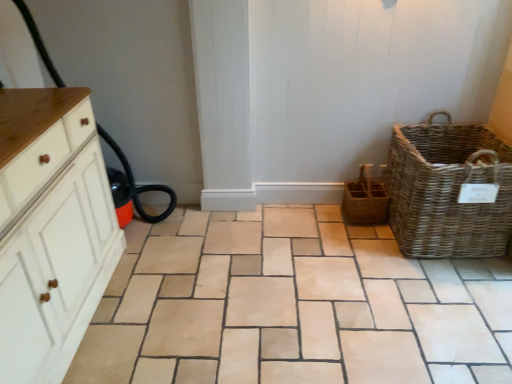
Question: Is white wood cabinet at left wider than natural stone tile at center?

Choices:
 (A) no
 (B) yes

Answer: (A)

Question: From a real-world perspective, is white wood cabinet at left under natural stone tile at center?

Choices:
 (A) no
 (B) yes

Answer: (A)

Question: Considering the relative sizes of white wood cabinet at left and natural stone tile at center in the image provided, is white wood cabinet at left bigger than natural stone tile at center?

Choices:
 (A) yes
 (B) no

Answer: (A)

Question: Is white wood cabinet at left completely or partially outside of natural stone tile at center?

Choices:
 (A) no
 (B) yes

Answer: (B)

Question: Can you confirm if white wood cabinet at left is shorter than natural stone tile at center?

Choices:
 (A) yes
 (B) no

Answer: (B)

Question: Is white wood cabinet at left bigger or smaller than brown woven basket at center-right?

Choices:
 (A) big
 (B) small

Answer: (A)

Question: From the image's perspective, is white wood cabinet at left positioned above or below brown woven basket at center-right?

Choices:
 (A) below
 (B) above

Answer: (A)

Question: Considering the positions of point (32, 94) and point (358, 205), is point (32, 94) closer or farther from the camera than point (358, 205)?

Choices:
 (A) farther
 (B) closer

Answer: (B)

Question: Relative to brown woven basket at center-right, is white wood cabinet at left in front or behind?

Choices:
 (A) behind
 (B) front

Answer: (B)

Question: Based on their positions, is natural woven picnic basket at right located to the left or right of brown woven basket at center-right?

Choices:
 (A) left
 (B) right

Answer: (B)

Question: From their relative heights in the image, would you say natural woven picnic basket at right is taller or shorter than brown woven basket at center-right?

Choices:
 (A) short
 (B) tall

Answer: (B)

Question: In terms of size, does natural woven picnic basket at right appear bigger or smaller than brown woven basket at center-right?

Choices:
 (A) small
 (B) big

Answer: (B)

Question: Looking at their shapes, would you say natural woven picnic basket at right is wider or thinner than brown woven basket at center-right?

Choices:
 (A) wide
 (B) thin

Answer: (A)

Question: Looking at the image, does natural stone tile at center seem bigger or smaller compared to brown woven basket at center-right?

Choices:
 (A) small
 (B) big

Answer: (B)

Question: Is point (259, 329) closer or farther from the camera than point (380, 200)?

Choices:
 (A) farther
 (B) closer

Answer: (B)